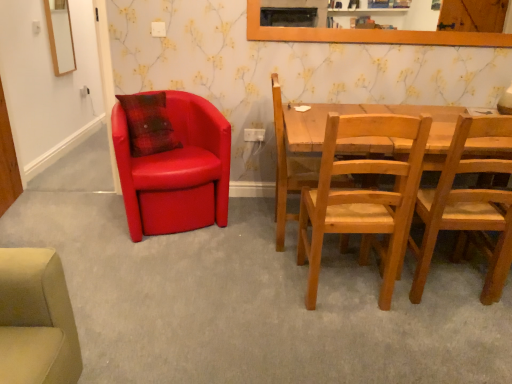
You are a GUI agent. You are given a task and a screenshot of the screen. Output one action in this format:
    pyautogui.click(x=<x>, y=<y>)
    Task: Click on the wooden chair at center, arranged as the 2th chair when viewed from the left
    
    Given the screenshot: What is the action you would take?
    pyautogui.click(x=284, y=169)

Describe the element at coordinates (158, 29) in the screenshot. I see `white plastic power outlet at upper center, the 1th power outlet positioned from the left` at that location.

Image resolution: width=512 pixels, height=384 pixels. Describe the element at coordinates (176, 170) in the screenshot. I see `matte leather chair at left, which appears as the 1th chair when viewed from the left` at that location.

Where is `matte leather chair at left, the 4th chair from the right`? matte leather chair at left, the 4th chair from the right is located at coordinates (176, 170).

Find the location of `wooden chair at center, arranged as the 2th chair when viewed from the left`. wooden chair at center, arranged as the 2th chair when viewed from the left is located at coordinates (284, 169).

Which of these two, white plastic power outlet at lower center, the first power outlet from the back, or wooden-framed mirror at upper left, is wider?

wooden-framed mirror at upper left is wider.

Is white plastic power outlet at lower center, which is counted as the 2th power outlet, starting from the top, aimed at wooden-framed mirror at upper left?

No, white plastic power outlet at lower center, which is counted as the 2th power outlet, starting from the top, is not facing towards wooden-framed mirror at upper left.

At what (x,y) coordinates should I click in order to perform the action: click on power outlet that is the 1st object located in front of the wooden-framed mirror at upper left. Please return your answer as a coordinate pair (x, y). The image size is (512, 384). Looking at the image, I should click on (254, 135).

Would you say white plastic power outlet at upper center, which ranks as the first power outlet in front-to-back order, is to the left or to the right of natural wood chair at center, placed as the second chair when sorted from right to left, in the picture?

Based on their positions, white plastic power outlet at upper center, which ranks as the first power outlet in front-to-back order, is located to the left of natural wood chair at center, placed as the second chair when sorted from right to left.

Considering the sizes of objects white plastic power outlet at upper center, the 1th power outlet positioned from the left, and natural wood chair at center, the 3th chair viewed from the left, in the image provided, who is taller, white plastic power outlet at upper center, the 1th power outlet positioned from the left, or natural wood chair at center, the 3th chair viewed from the left,?

natural wood chair at center, the 3th chair viewed from the left, is taller.

Considering the sizes of white plastic power outlet at upper center, the second power outlet when ordered from bottom to top, and natural wood chair at center, placed as the second chair when sorted from right to left, in the image, is white plastic power outlet at upper center, the second power outlet when ordered from bottom to top, wider or thinner than natural wood chair at center, placed as the second chair when sorted from right to left,?

Considering their sizes, white plastic power outlet at upper center, the second power outlet when ordered from bottom to top, looks slimmer than natural wood chair at center, placed as the second chair when sorted from right to left.

Which of these two, light brown wooden chair at right, the fourth chair from the left, or wooden chair at center, positioned as the 3th chair in right-to-left order, is bigger?

wooden chair at center, positioned as the 3th chair in right-to-left order.

Measure the distance from light brown wooden chair at right, the fourth chair from the left, to wooden chair at center, positioned as the 3th chair in right-to-left order.

A distance of 30.41 inches exists between light brown wooden chair at right, the fourth chair from the left, and wooden chair at center, positioned as the 3th chair in right-to-left order.

Which object is wider, light brown wooden chair at right, the fourth chair from the left, or wooden chair at center, positioned as the 3th chair in right-to-left order?

With larger width is wooden chair at center, positioned as the 3th chair in right-to-left order.

The width and height of the screenshot is (512, 384). Find the location of `the 2nd chair to the left of the light brown wooden chair at right, acting as the first chair starting from the right, starting your count from the anchor`. the 2nd chair to the left of the light brown wooden chair at right, acting as the first chair starting from the right, starting your count from the anchor is located at coordinates (284, 169).

Is point (411, 203) farther from viewer compared to point (151, 23)?

No, it is not.

At what (x,y) coordinates should I click in order to perform the action: click on the 2nd power outlet above the natural wood chair at center, the 3th chair viewed from the left (from a real-world perspective). Please return your answer as a coordinate pair (x, y). The width and height of the screenshot is (512, 384). Looking at the image, I should click on (158, 29).

Based on the photo, can you confirm if natural wood chair at center, placed as the second chair when sorted from right to left, is taller than white plastic power outlet at upper center, which appears as the first power outlet when viewed from the top?

Yes, natural wood chair at center, placed as the second chair when sorted from right to left, is taller than white plastic power outlet at upper center, which appears as the first power outlet when viewed from the top.

Could white plastic power outlet at upper center, the second power outlet when ordered from bottom to top, be considered to be inside natural wood chair at center, the 3th chair viewed from the left?

No, white plastic power outlet at upper center, the second power outlet when ordered from bottom to top, is not a part of natural wood chair at center, the 3th chair viewed from the left.

From the picture: Is white plastic power outlet at lower center, the first power outlet from the back, positioned with its back to light brown wooden chair at right, the fourth chair from the left?

white plastic power outlet at lower center, the first power outlet from the back, does not have its back to light brown wooden chair at right, the fourth chair from the left.

Could you measure the distance between white plastic power outlet at lower center, arranged as the first power outlet when ordered from the bottom, and light brown wooden chair at right, acting as the first chair starting from the right?

The distance of white plastic power outlet at lower center, arranged as the first power outlet when ordered from the bottom, from light brown wooden chair at right, acting as the first chair starting from the right, is 4.71 feet.

Considering the relative sizes of white plastic power outlet at lower center, which is counted as the 2th power outlet, starting from the top, and light brown wooden chair at right, the fourth chair from the left, in the image provided, is white plastic power outlet at lower center, which is counted as the 2th power outlet, starting from the top, bigger than light brown wooden chair at right, the fourth chair from the left,?

Incorrect, white plastic power outlet at lower center, which is counted as the 2th power outlet, starting from the top, is not larger than light brown wooden chair at right, the fourth chair from the left.

Does point (258, 133) come in front of point (445, 169)?

That is False.

Looking at this image, choose the correct answer: Is light brown wooden chair at right, the fourth chair from the left, inside natural wood chair at center, the 3th chair viewed from the left, or outside it?

light brown wooden chair at right, the fourth chair from the left, is spatially situated outside natural wood chair at center, the 3th chair viewed from the left.

Which is closer to the camera, (465, 163) or (418, 119)?

Point (465, 163) is positioned farther from the camera compared to point (418, 119).

At what (x,y) coordinates should I click in order to perform the action: click on chair below the light brown wooden chair at right, acting as the first chair starting from the right (from the image's perspective). Please return your answer as a coordinate pair (x, y). The width and height of the screenshot is (512, 384). Looking at the image, I should click on (362, 198).

Relative to natural wood chair at center, the 3th chair viewed from the left, is light brown wooden chair at right, the fourth chair from the left, in front or behind?

Clearly, light brown wooden chair at right, the fourth chair from the left, is behind natural wood chair at center, the 3th chair viewed from the left.

From a real-world perspective, count 1st chairs downward from the white plastic power outlet at lower center, the first power outlet from the back, and point to it. Please provide its 2D coordinates.

[(362, 198)]

Which of these two, white plastic power outlet at lower center, the first power outlet from the back, or natural wood chair at center, the 3th chair viewed from the left, stands shorter?

Standing shorter between the two is white plastic power outlet at lower center, the first power outlet from the back.

From a real-world perspective, is white plastic power outlet at lower center, arranged as the first power outlet when ordered from the bottom, physically located above or below natural wood chair at center, placed as the second chair when sorted from right to left?

Clearly, from a real-world perspective, white plastic power outlet at lower center, arranged as the first power outlet when ordered from the bottom, is above natural wood chair at center, placed as the second chair when sorted from right to left.

Is there a large distance between white plastic power outlet at lower center, the 2th power outlet positioned from the left, and natural wood chair at center, placed as the second chair when sorted from right to left?

Yes, white plastic power outlet at lower center, the 2th power outlet positioned from the left, and natural wood chair at center, placed as the second chair when sorted from right to left, are located far from each other.

Image resolution: width=512 pixels, height=384 pixels. There is a white plastic power outlet at lower center, arranged as the first power outlet when ordered from the bottom. In order to click on mirror above it (from a real-world perspective) in this screenshot , I will do `click(60, 36)`.

Identify the location of power outlet that is the 2nd object to the left of the natural wood chair at center, the 3th chair viewed from the left, starting at the anchor. (158, 29).

Based on their spatial positions, is wooden-framed mirror at upper left or white plastic power outlet at lower center, which is counted as the 2th power outlet, starting from the top, further from white plastic power outlet at upper center, which appears as the first power outlet when viewed from the top?

wooden-framed mirror at upper left is further to white plastic power outlet at upper center, which appears as the first power outlet when viewed from the top.

From the image, which object appears to be nearer to wooden chair at center, positioned as the 3th chair in right-to-left order, white plastic power outlet at lower center, the first power outlet from the back, or natural wood chair at center, the 3th chair viewed from the left?

natural wood chair at center, the 3th chair viewed from the left, is positioned closer to the anchor wooden chair at center, positioned as the 3th chair in right-to-left order.

Looking at the image, which one is located further to light brown wooden chair at right, the fourth chair from the left, matte leather chair at left, the 4th chair from the right, or white plastic power outlet at upper center, which is the second power outlet in back-to-front order?

white plastic power outlet at upper center, which is the second power outlet in back-to-front order.

Looking at the image, which one is located closer to white plastic power outlet at upper center, the second power outlet when ordered from bottom to top, natural wood chair at center, placed as the second chair when sorted from right to left, or wooden chair at center, positioned as the 3th chair in right-to-left order?

Among the two, wooden chair at center, positioned as the 3th chair in right-to-left order, is located nearer to white plastic power outlet at upper center, the second power outlet when ordered from bottom to top.

From the image, which object appears to be nearer to wooden chair at center, arranged as the 2th chair when viewed from the left, light brown wooden chair at right, the fourth chair from the left, or natural wood chair at center, the 3th chair viewed from the left?

natural wood chair at center, the 3th chair viewed from the left, lies closer to wooden chair at center, arranged as the 2th chair when viewed from the left, than the other object.

Estimate the real-world distances between objects in this image. Which object is further from white plastic power outlet at upper center, which appears as the first power outlet when viewed from the top, wooden-framed mirror at upper left or matte leather chair at left, which appears as the 1th chair when viewed from the left?

wooden-framed mirror at upper left is further to white plastic power outlet at upper center, which appears as the first power outlet when viewed from the top.

Considering their positions, is natural wood chair at center, placed as the second chair when sorted from right to left, positioned further to light brown wooden chair at right, acting as the first chair starting from the right, than white plastic power outlet at upper center, which is the second power outlet in back-to-front order?

white plastic power outlet at upper center, which is the second power outlet in back-to-front order.

Based on their spatial positions, is natural wood chair at center, placed as the second chair when sorted from right to left, or matte leather chair at left, the 4th chair from the right, closer to wooden chair at center, positioned as the 3th chair in right-to-left order?

matte leather chair at left, the 4th chair from the right, is positioned closer to the anchor wooden chair at center, positioned as the 3th chair in right-to-left order.

Locate an element on the screen. This screenshot has width=512, height=384. chair situated between matte leather chair at left, which appears as the 1th chair when viewed from the left, and natural wood chair at center, the 3th chair viewed from the left, from left to right is located at coordinates (284, 169).

Where is `power outlet situated between wooden-framed mirror at upper left and white plastic power outlet at lower center, the 2th power outlet positioned from the left, from left to right`? power outlet situated between wooden-framed mirror at upper left and white plastic power outlet at lower center, the 2th power outlet positioned from the left, from left to right is located at coordinates (158, 29).

Where is `chair between wooden chair at center, positioned as the 3th chair in right-to-left order, and white plastic power outlet at lower center, which is counted as the 2th power outlet, starting from the top, from front to back`? chair between wooden chair at center, positioned as the 3th chair in right-to-left order, and white plastic power outlet at lower center, which is counted as the 2th power outlet, starting from the top, from front to back is located at coordinates (176, 170).

At what (x,y) coordinates should I click in order to perform the action: click on chair between wooden-framed mirror at upper left and white plastic power outlet at lower center, arranged as the first power outlet when ordered from the bottom. Please return your answer as a coordinate pair (x, y). Looking at the image, I should click on (176, 170).